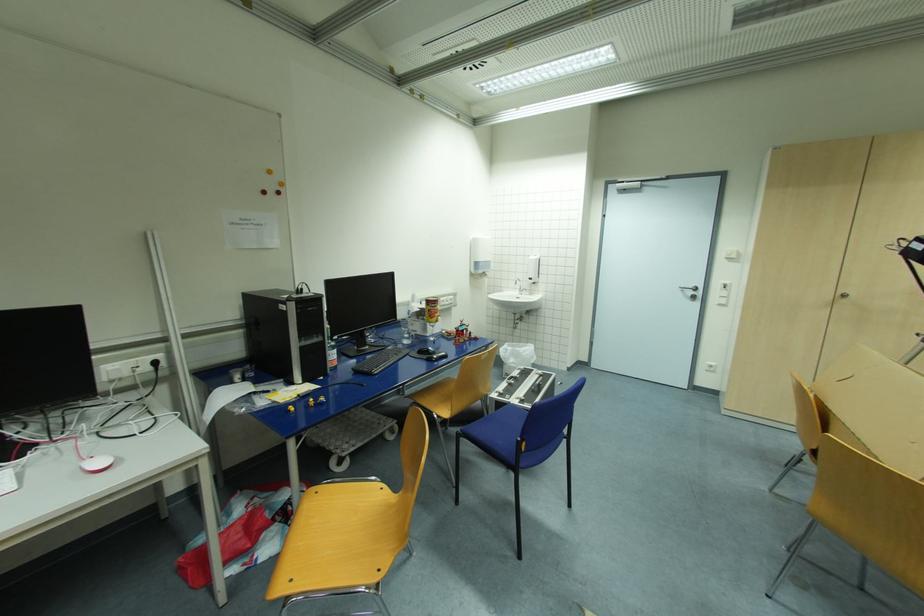
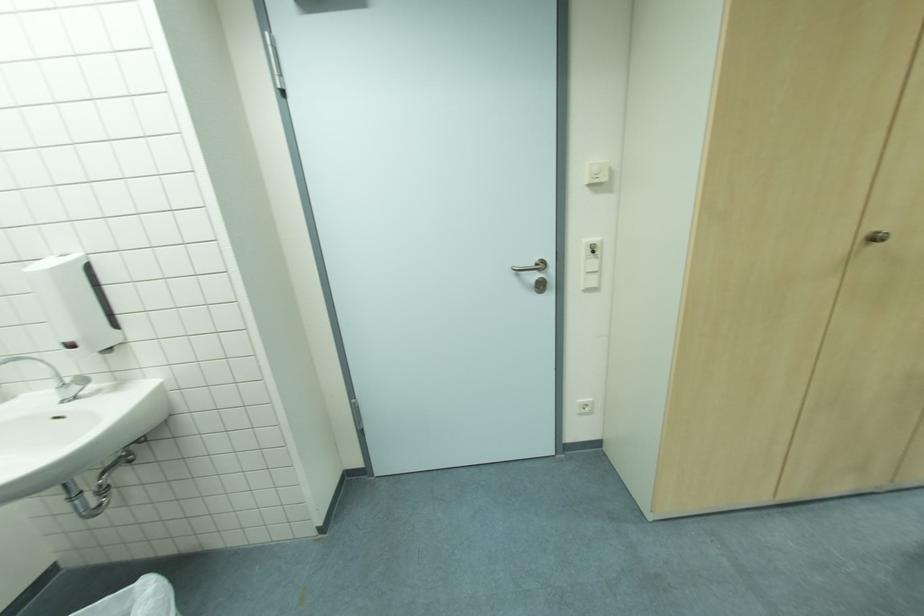
Where in the second image is the point corresponding to (x=736, y=257) from the first image?

(608, 179)